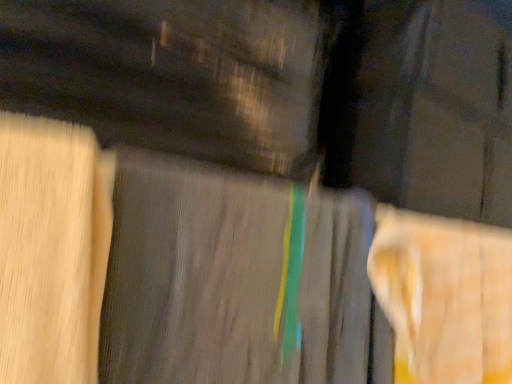
The width and height of the screenshot is (512, 384). What do you see at coordinates (445, 295) in the screenshot?
I see `yellow textured fabric at right` at bounding box center [445, 295].

In order to face yellow textured fabric at right, should I rotate leftwards or rightwards?

To align with it, rotate right about 25.880°.

This screenshot has height=384, width=512. I want to click on yellow textured fabric at right, so click(x=445, y=295).

Find the location of `yellow textured fabric at right`. yellow textured fabric at right is located at coordinates (445, 295).